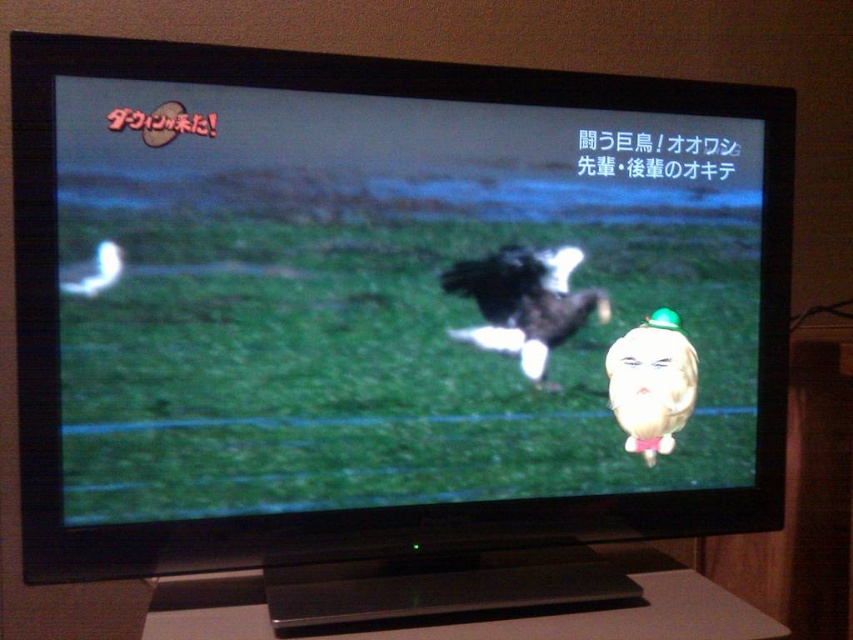
You are a birdwatcher observing the image on the TV screen. You see a black plastic flat at lower center and a black glossy eagle at center. Which object is taller in the image?

The black glossy eagle at center is taller than the black plastic flat at lower center.

You are a bird enthusiast watching this TV show. You see the black matte eagle at center and the black plastic flat at lower center. Which object is positioned higher on the screen?

The black matte eagle at center is positioned higher on the screen than the black plastic flat at lower center.

You are looking at a childrens toy display in a store. You see a black plastic flat at lower center and a matte yellow duck at center. Which toy is closer to you?

The black plastic flat at lower center is closer to the viewer than the matte yellow duck at center.